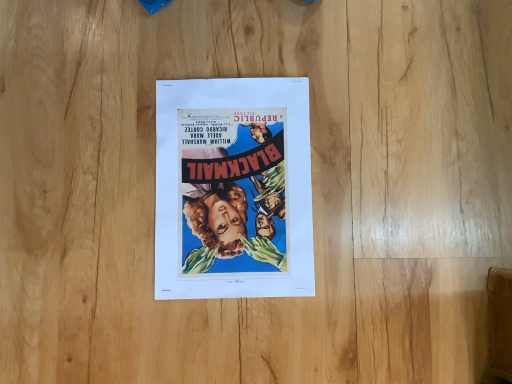
The width and height of the screenshot is (512, 384). I want to click on blank space situated above matte paper poster at center (from a real-world perspective), so click(x=232, y=182).